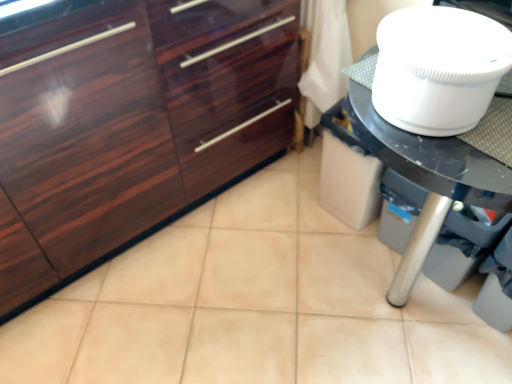
Question: Relative to white plastic toilet bowl at upper right, is glossy wood cabinetry at left in front or behind?

Choices:
 (A) front
 (B) behind

Answer: (B)

Question: Considering the positions of glossy wood cabinetry at left and white plastic toilet bowl at upper right in the image, is glossy wood cabinetry at left wider or thinner than white plastic toilet bowl at upper right?

Choices:
 (A) wide
 (B) thin

Answer: (A)

Question: Considering the real-world distances, which object is farthest from the white glossy table at right?

Choices:
 (A) white plastic toilet bowl at upper right
 (B) glossy wood cabinetry at left

Answer: (B)

Question: Estimate the real-world distances between objects in this image. Which object is farther from the white plastic toilet bowl at upper right?

Choices:
 (A) glossy wood cabinetry at left
 (B) white glossy table at right

Answer: (A)